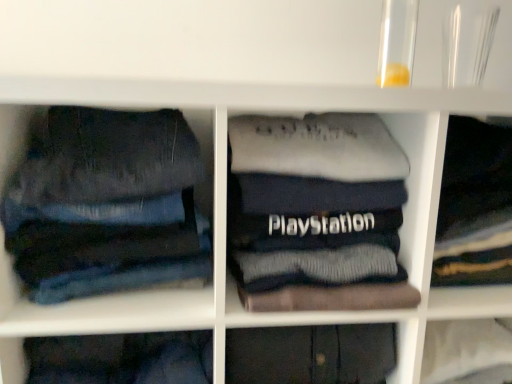
Question: Does dark gray sweater at center, acting as the 1th clothing starting from the right, turn towards dark blue cotton sweatshirt at center, the second clothing from the right?

Choices:
 (A) yes
 (B) no

Answer: (B)

Question: Is dark gray sweater at center, acting as the 1th clothing starting from the right, wider than dark blue cotton sweatshirt at center, which ranks as the first clothing in left-to-right order?

Choices:
 (A) yes
 (B) no

Answer: (B)

Question: Is dark blue cotton sweatshirt at center, which ranks as the first clothing in left-to-right order, at the back of dark gray sweater at center, the second clothing from the left?

Choices:
 (A) yes
 (B) no

Answer: (B)

Question: Is dark gray sweater at center, the second clothing from the left, closer to camera compared to dark blue cotton sweatshirt at center, the second clothing from the right?

Choices:
 (A) yes
 (B) no

Answer: (B)

Question: Can you confirm if dark gray sweater at center, the second clothing from the left, is positioned to the right of dark blue cotton sweatshirt at center, the second clothing from the right?

Choices:
 (A) no
 (B) yes

Answer: (B)

Question: Is denim jeans at left bigger or smaller than dark blue cotton sweatshirt at center, the second clothing from the right?

Choices:
 (A) small
 (B) big

Answer: (A)

Question: Considering their positions, is denim jeans at left located in front of or behind dark blue cotton sweatshirt at center, the second clothing from the right?

Choices:
 (A) front
 (B) behind

Answer: (A)

Question: From the image's perspective, is denim jeans at left above or below dark blue cotton sweatshirt at center, which ranks as the first clothing in left-to-right order?

Choices:
 (A) above
 (B) below

Answer: (A)

Question: Considering the positions of denim jeans at left and dark blue cotton sweatshirt at center, which ranks as the first clothing in left-to-right order, in the image, is denim jeans at left wider or thinner than dark blue cotton sweatshirt at center, which ranks as the first clothing in left-to-right order,?

Choices:
 (A) wide
 (B) thin

Answer: (B)

Question: Is point (301, 167) closer or farther from the camera than point (444, 167)?

Choices:
 (A) farther
 (B) closer

Answer: (B)

Question: Is dark blue cotton sweatshirt at center, which ranks as the first clothing in left-to-right order, to the left or to the right of dark gray sweater at center, the second clothing from the left, in the image?

Choices:
 (A) right
 (B) left

Answer: (B)

Question: From their relative heights in the image, would you say dark blue cotton sweatshirt at center, which ranks as the first clothing in left-to-right order, is taller or shorter than dark gray sweater at center, acting as the 1th clothing starting from the right?

Choices:
 (A) tall
 (B) short

Answer: (A)

Question: From a real-world perspective, is dark blue cotton sweatshirt at center, which ranks as the first clothing in left-to-right order, positioned above or below dark gray sweater at center, the second clothing from the left?

Choices:
 (A) above
 (B) below

Answer: (A)

Question: Visually, is denim jeans at left positioned to the left or to the right of dark gray sweater at center, acting as the 1th clothing starting from the right?

Choices:
 (A) right
 (B) left

Answer: (B)

Question: From a real-world perspective, relative to dark gray sweater at center, acting as the 1th clothing starting from the right, is denim jeans at left vertically above or below?

Choices:
 (A) below
 (B) above

Answer: (B)